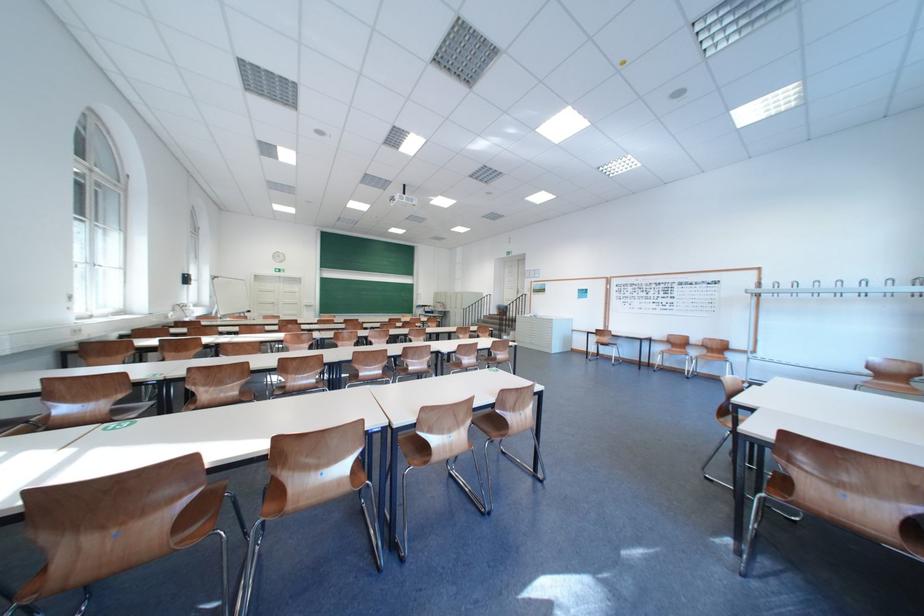
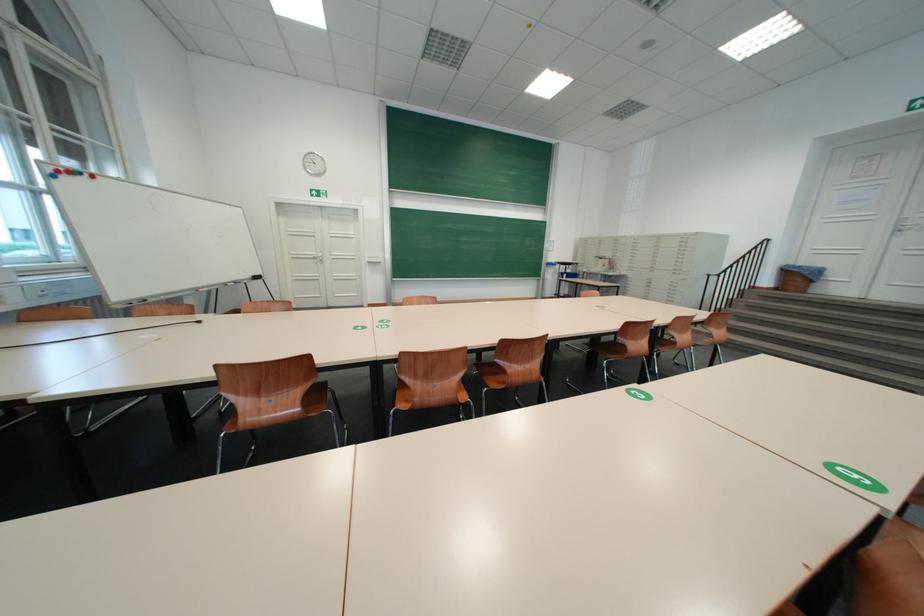
The point at (507, 313) is marked in the first image. Where is the corresponding point in the second image?

(781, 283)